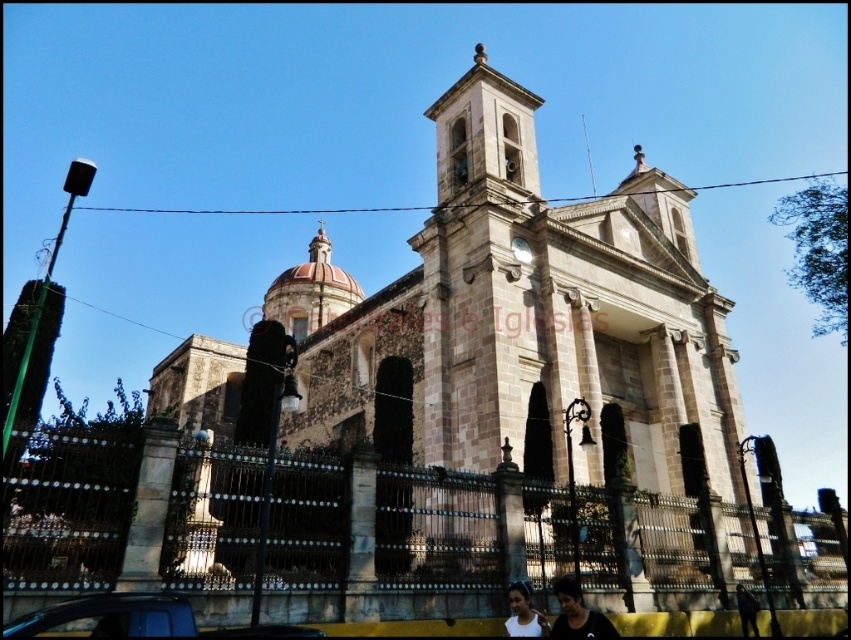
Question: Which of the following is the farthest from the observer?

Choices:
 (A) (577, 616)
 (B) (168, 605)

Answer: (A)

Question: Can you confirm if metallic blue car at lower left is smaller than dark blue fabric at lower right?

Choices:
 (A) no
 (B) yes

Answer: (A)

Question: Which of the following is the closest to the observer?

Choices:
 (A) stone church at center
 (B) white matte shirt at lower center
 (C) metallic blue car at lower left
 (D) black fabric at lower center

Answer: (C)

Question: Is metallic blue car at lower left further to camera compared to black fabric at lower center?

Choices:
 (A) no
 (B) yes

Answer: (A)

Question: In this image, where is stone church at center located relative to white matte shirt at lower center?

Choices:
 (A) above
 (B) below

Answer: (A)

Question: Which of the following is the farthest from the observer?

Choices:
 (A) (669, 412)
 (B) (743, 624)

Answer: (A)